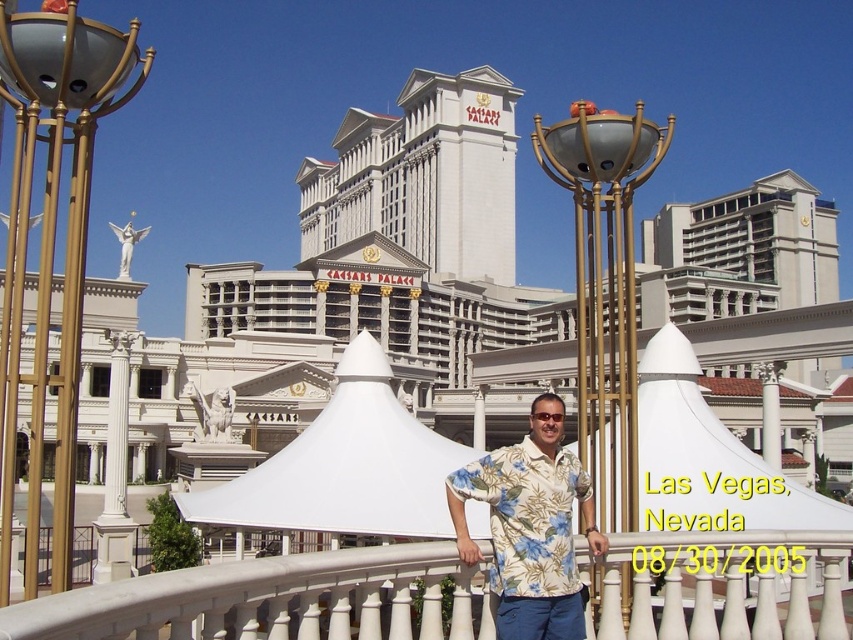
Question: Does white glossy rail at center appear over gold metallic lamp post at center?

Choices:
 (A) yes
 (B) no

Answer: (B)

Question: Observing the image, what is the correct spatial positioning of gold metallic lamp post at upper left in reference to white fabric canopy at center?

Choices:
 (A) right
 (B) left

Answer: (B)

Question: Which object is positioned farthest from the white fabric canopy at center?

Choices:
 (A) floral print shirt at center
 (B) white glossy rail at center

Answer: (A)

Question: Can you confirm if white fabric canopy at center is bigger than floral print shirt at center?

Choices:
 (A) no
 (B) yes

Answer: (B)

Question: Estimate the real-world distances between objects in this image. Which object is closer to the gold metallic lamp post at upper left?

Choices:
 (A) floral print shirt at center
 (B) white glossy rail at center

Answer: (B)

Question: Which of the following is the closest to the observer?

Choices:
 (A) (149, 588)
 (B) (531, 497)

Answer: (A)